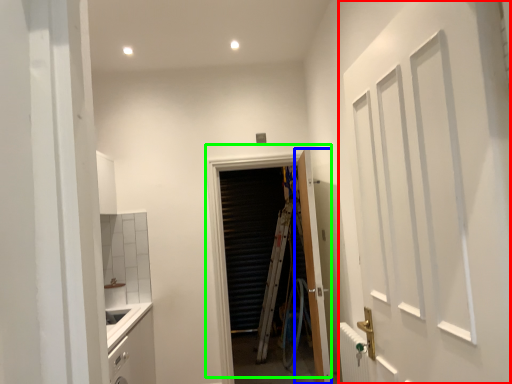
Question: Which is nearer to the door (highlighted by a red box)? door (highlighted by a blue box) or door (highlighted by a green box).

Choices:
 (A) door
 (B) door

Answer: (A)